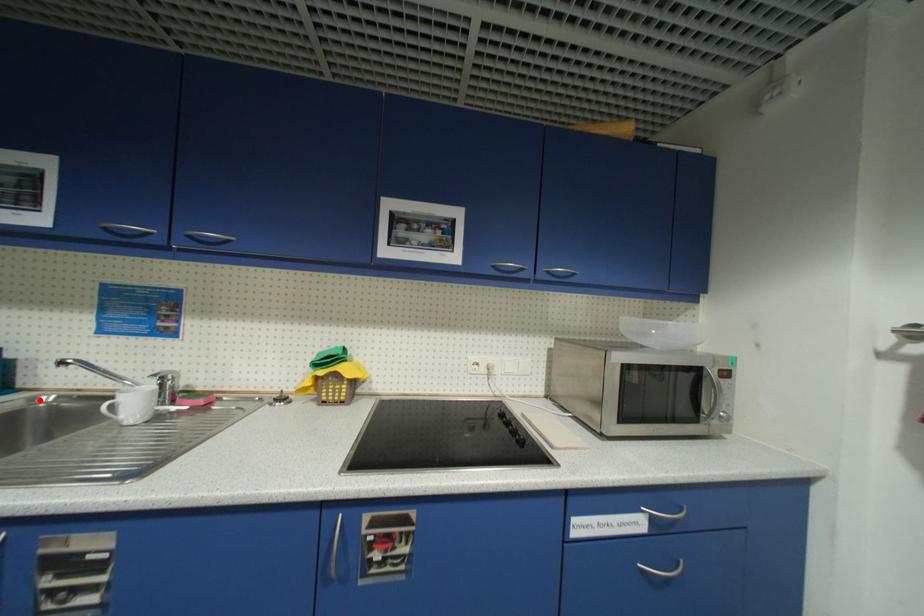
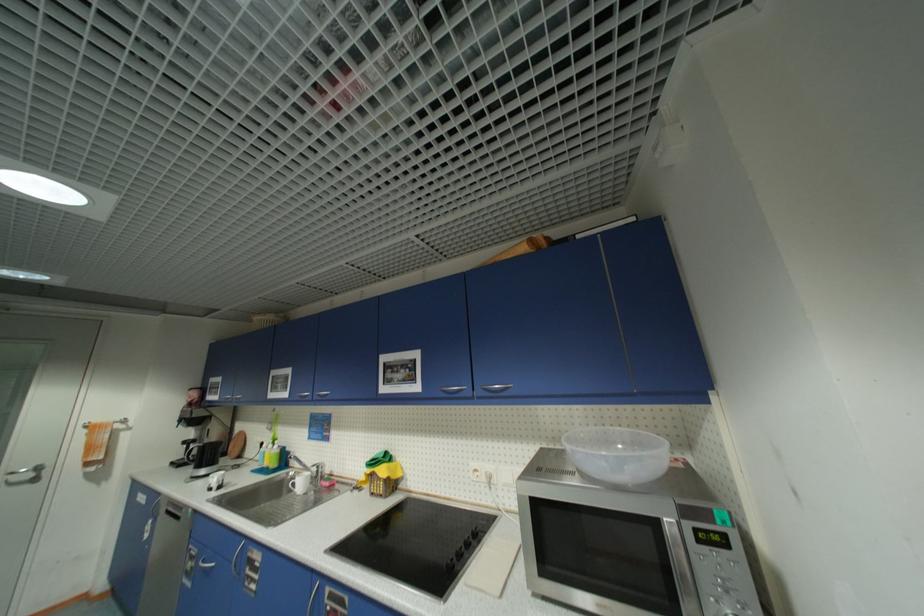
Question: I am providing you with two images of the same scene from different viewpoints. A red point is shown in image1. For the corresponding object point in image2, is it positioned nearer or farther from the camera?

Choices:
 (A) Nearer
 (B) Farther

Answer: (B)